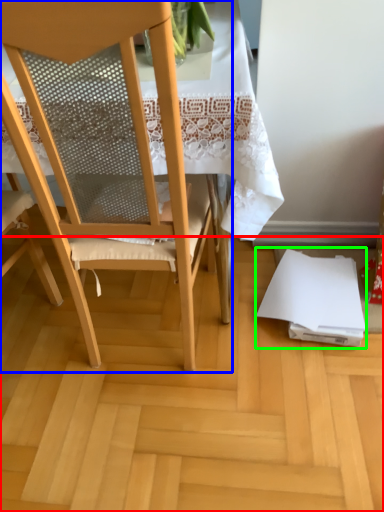
Question: Based on their relative distances, which object is farther from plywood (highlighted by a red box)? Choose from chair (highlighted by a blue box) and notebook (highlighted by a green box).

Choices:
 (A) chair
 (B) notebook

Answer: (A)